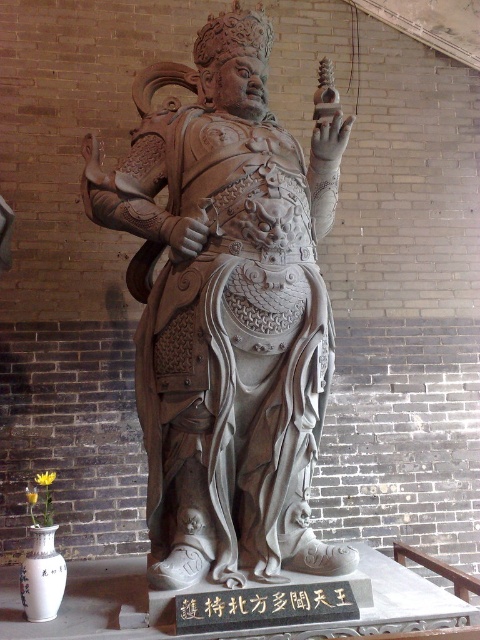
You are an art conservator examining the image. You need to determine if the gray stone statue at center is large enough to have the black stone text at center placed on its base. Can you confirm based on their sizes?

The gray stone statue at center is larger than the black stone text at center, so yes, the statue is large enough to accommodate the text on its base.

You are standing in a museum and see the gray stone statue at center. If you want to touch the statue, how many steps do you need to take forward to reach it if each step covers 0.75 meters?

The gray stone statue at center is 2.57 meters away from viewer. Since each step covers 0.75 meters, you would need to take approximately 4 steps forward to reach it. 2.57 divided by 0.75 is approximately 3.43, so rounding up to the nearest whole number gives 4 steps.